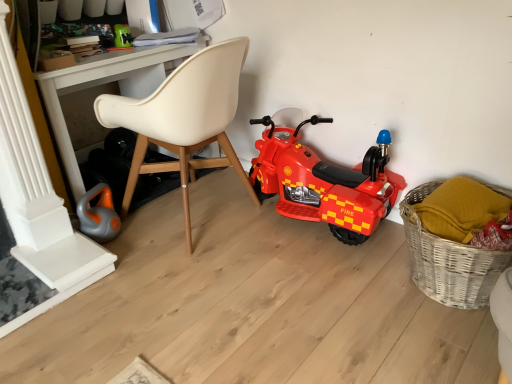
What do you see at coordinates (325, 182) in the screenshot?
I see `red plastic toy motorcycle at center` at bounding box center [325, 182].

What is the approximate height of beige leather chair at center?

33.57 inches.

What do you see at coordinates (448, 260) in the screenshot? This screenshot has height=384, width=512. I see `woven wicker basket at lower right` at bounding box center [448, 260].

The width and height of the screenshot is (512, 384). In order to click on green plastic toy at upper left, the 2th toy ordered from the bottom in this screenshot , I will do `click(122, 36)`.

The width and height of the screenshot is (512, 384). I want to click on white plastic desk at upper center, so click(101, 93).

The width and height of the screenshot is (512, 384). I want to click on orange rubber toy at lower left, positioned as the second toy in top-to-bottom order, so click(98, 215).

Could beige leather chair at center be considered to be inside orange rubber toy at lower left, which is the 1th toy in bottom-to-top order?

No, beige leather chair at center is not a part of orange rubber toy at lower left, which is the 1th toy in bottom-to-top order.

From a real-world perspective, who is located lower, orange rubber toy at lower left, the first toy when ordered from front to back, or beige leather chair at center?

orange rubber toy at lower left, the first toy when ordered from front to back.

Is there a large distance between orange rubber toy at lower left, which is the 1th toy in bottom-to-top order, and beige leather chair at center?

orange rubber toy at lower left, which is the 1th toy in bottom-to-top order, is actually quite close to beige leather chair at center.

Is orange rubber toy at lower left, the first toy when ordered from front to back, facing towards beige leather chair at center?

Yes, orange rubber toy at lower left, the first toy when ordered from front to back, is oriented towards beige leather chair at center.

Which is nearer, (106, 233) or (67, 84)?

Clearly, point (106, 233) is more distant from the camera than point (67, 84).

Between orange rubber toy at lower left, which is the 1th toy in bottom-to-top order, and white plastic desk at upper center, which one has larger width?

white plastic desk at upper center is wider.

How many degrees apart are the facing directions of orange rubber toy at lower left, which is the 1th toy in bottom-to-top order, and white plastic desk at upper center?

The facing directions of orange rubber toy at lower left, which is the 1th toy in bottom-to-top order, and white plastic desk at upper center are 10.8 degrees apart.

At what (x,y) coordinates should I click in order to perform the action: click on toy lying below the beige leather chair at center (from the image's perspective). Please return your answer as a coordinate pair (x, y). This screenshot has height=384, width=512. Looking at the image, I should click on point(98,215).

Is beige leather chair at center positioned with its back to orange rubber toy at lower left, the first toy when ordered from front to back?

No, beige leather chair at center is not facing away from orange rubber toy at lower left, the first toy when ordered from front to back.

Is point (180, 162) farther from camera compared to point (93, 225)?

Yes.

From the image's perspective, is beige leather chair at center on orange rubber toy at lower left, which is the 1th toy in bottom-to-top order?

Yes, from the image's perspective, beige leather chair at center is above orange rubber toy at lower left, which is the 1th toy in bottom-to-top order.

Is orange rubber toy at lower left, arranged as the 2th toy when viewed from the back, at the left side of green plastic toy at upper left, which ranks as the second toy in front-to-back order?

Indeed, orange rubber toy at lower left, arranged as the 2th toy when viewed from the back, is positioned on the left side of green plastic toy at upper left, which ranks as the second toy in front-to-back order.

Does orange rubber toy at lower left, arranged as the 2th toy when viewed from the back, have a lesser width compared to green plastic toy at upper left, which appears as the first toy when viewed from the top?

No, orange rubber toy at lower left, arranged as the 2th toy when viewed from the back, is not thinner than green plastic toy at upper left, which appears as the first toy when viewed from the top.

Who is taller, orange rubber toy at lower left, arranged as the 2th toy when viewed from the back, or green plastic toy at upper left, which appears as the first toy when viewed from the top?

orange rubber toy at lower left, arranged as the 2th toy when viewed from the back.

Is orange rubber toy at lower left, which is the 1th toy in bottom-to-top order, bigger or smaller than green plastic toy at upper left, which ranks as the second toy in front-to-back order?

orange rubber toy at lower left, which is the 1th toy in bottom-to-top order, is bigger than green plastic toy at upper left, which ranks as the second toy in front-to-back order.

In the scene shown: Is orange rubber toy at lower left, the first toy when ordered from front to back, to the left of red plastic toy motorcycle at center from the viewer's perspective?

Yes, orange rubber toy at lower left, the first toy when ordered from front to back, is to the left of red plastic toy motorcycle at center.

In the scene shown: Considering the relative sizes of orange rubber toy at lower left, the first toy when ordered from front to back, and red plastic toy motorcycle at center in the image provided, is orange rubber toy at lower left, the first toy when ordered from front to back, thinner than red plastic toy motorcycle at center?

Yes.

Is orange rubber toy at lower left, arranged as the 2th toy when viewed from the back, far away from red plastic toy motorcycle at center?

No, orange rubber toy at lower left, arranged as the 2th toy when viewed from the back, is in close proximity to red plastic toy motorcycle at center.

Looking at the image, does orange rubber toy at lower left, the first toy when ordered from front to back, seem bigger or smaller compared to red plastic toy motorcycle at center?

Considering their sizes, orange rubber toy at lower left, the first toy when ordered from front to back, takes up less space than red plastic toy motorcycle at center.

From the image's perspective, is red plastic toy motorcycle at center above or below orange rubber toy at lower left, which is the 1th toy in bottom-to-top order?

Based on their image positions, red plastic toy motorcycle at center is located above orange rubber toy at lower left, which is the 1th toy in bottom-to-top order.

Is red plastic toy motorcycle at center positioned beyond the bounds of orange rubber toy at lower left, the first toy when ordered from front to back?

Yes.

Is red plastic toy motorcycle at center smaller than orange rubber toy at lower left, positioned as the second toy in top-to-bottom order?

Incorrect, red plastic toy motorcycle at center is not smaller in size than orange rubber toy at lower left, positioned as the second toy in top-to-bottom order.

Which object is wider, red plastic toy motorcycle at center or orange rubber toy at lower left, positioned as the second toy in top-to-bottom order?

With larger width is red plastic toy motorcycle at center.

Which object is positioned more to the left, beige leather chair at center or red plastic toy motorcycle at center?

From the viewer's perspective, beige leather chair at center appears more on the left side.

How many degrees apart are the facing directions of beige leather chair at center and red plastic toy motorcycle at center?

The facing directions of beige leather chair at center and red plastic toy motorcycle at center are 90 degrees apart.

Can you confirm if beige leather chair at center is smaller than red plastic toy motorcycle at center?

No.

Is beige leather chair at center far from red plastic toy motorcycle at center?

No, there isn't a large distance between beige leather chair at center and red plastic toy motorcycle at center.

Which toy is the 1st one when counting from the back of the beige leather chair at center? Please provide its 2D coordinates.

[(98, 215)]

Locate an element on the screen. The height and width of the screenshot is (384, 512). desk in front of the orange rubber toy at lower left, which is the 1th toy in bottom-to-top order is located at coordinates (101, 93).

From the image, which object appears to be nearer to white plastic desk at upper center, green plastic toy at upper left, which appears as the first toy when viewed from the top, or woven wicker basket at lower right?

Among the two, green plastic toy at upper left, which appears as the first toy when viewed from the top, is located nearer to white plastic desk at upper center.

From the image, which object appears to be farther from beige leather chair at center, woven wicker basket at lower right or orange rubber toy at lower left, the first toy when ordered from front to back?

woven wicker basket at lower right is further to beige leather chair at center.

Estimate the real-world distances between objects in this image. Which object is closer to beige leather chair at center, woven wicker basket at lower right or red plastic toy motorcycle at center?

Based on the image, red plastic toy motorcycle at center appears to be nearer to beige leather chair at center.

Estimate the real-world distances between objects in this image. Which object is further from beige leather chair at center, orange rubber toy at lower left, which is the 1th toy in bottom-to-top order, or woven wicker basket at lower right?

Based on the image, woven wicker basket at lower right appears to be further to beige leather chair at center.

Based on their spatial positions, is beige leather chair at center or woven wicker basket at lower right further from white plastic desk at upper center?

woven wicker basket at lower right.

Looking at the image, which one is located closer to orange rubber toy at lower left, positioned as the second toy in top-to-bottom order, green plastic toy at upper left, arranged as the first toy when viewed from the back, or white plastic desk at upper center?

white plastic desk at upper center lies closer to orange rubber toy at lower left, positioned as the second toy in top-to-bottom order, than the other object.

Which object lies further to the anchor point woven wicker basket at lower right, orange rubber toy at lower left, arranged as the 2th toy when viewed from the back, or white plastic desk at upper center?

white plastic desk at upper center is further to woven wicker basket at lower right.

Considering their positions, is red plastic toy motorcycle at center positioned further to beige leather chair at center than orange rubber toy at lower left, the first toy when ordered from front to back?

red plastic toy motorcycle at center lies further to beige leather chair at center than the other object.

I want to click on desk between orange rubber toy at lower left, positioned as the second toy in top-to-bottom order, and red plastic toy motorcycle at center, so click(x=101, y=93).

Where is `toy situated between orange rubber toy at lower left, positioned as the second toy in top-to-bottom order, and woven wicker basket at lower right from left to right`? This screenshot has width=512, height=384. toy situated between orange rubber toy at lower left, positioned as the second toy in top-to-bottom order, and woven wicker basket at lower right from left to right is located at coordinates (122, 36).

This screenshot has height=384, width=512. Identify the location of chair between orange rubber toy at lower left, arranged as the 2th toy when viewed from the back, and woven wicker basket at lower right, in the horizontal direction. (184, 119).

The width and height of the screenshot is (512, 384). Find the location of `chair located between green plastic toy at upper left, which ranks as the second toy in front-to-back order, and red plastic toy motorcycle at center in the left-right direction`. chair located between green plastic toy at upper left, which ranks as the second toy in front-to-back order, and red plastic toy motorcycle at center in the left-right direction is located at coordinates (184, 119).